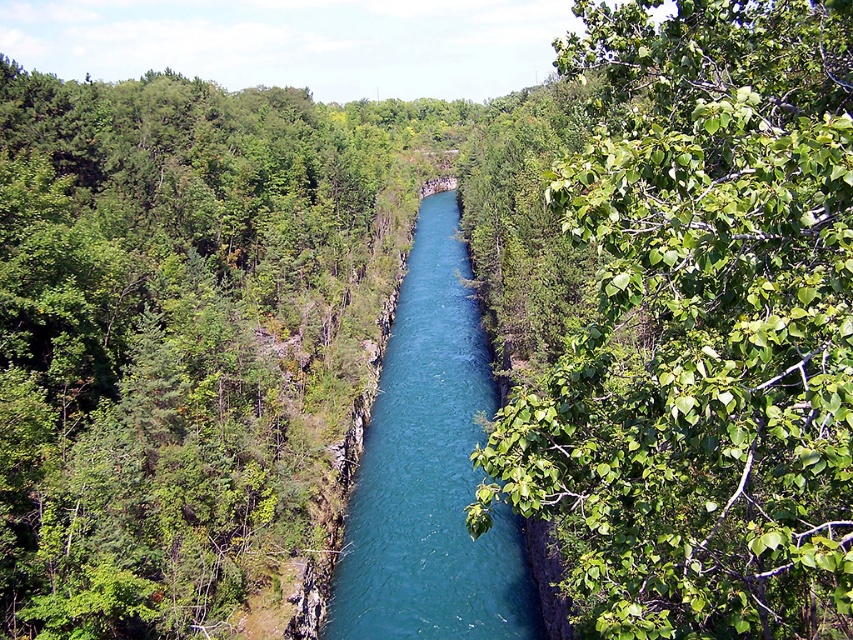
Question: Which point is closer to the camera taking this photo?

Choices:
 (A) (572, 582)
 (B) (412, 628)

Answer: (A)

Question: Which point appears closest to the camera in this image?

Choices:
 (A) (805, 499)
 (B) (379, 566)

Answer: (A)

Question: Is green leafy tree at center right above blue glossy water at center?

Choices:
 (A) yes
 (B) no

Answer: (A)

Question: Which point appears closest to the camera in this image?

Choices:
 (A) (833, 112)
 (B) (485, 371)

Answer: (A)

Question: Is green leafy tree at center right to the left of blue glossy water at center from the viewer's perspective?

Choices:
 (A) yes
 (B) no

Answer: (B)

Question: Is green leafy tree at center right bigger than blue glossy water at center?

Choices:
 (A) yes
 (B) no

Answer: (A)